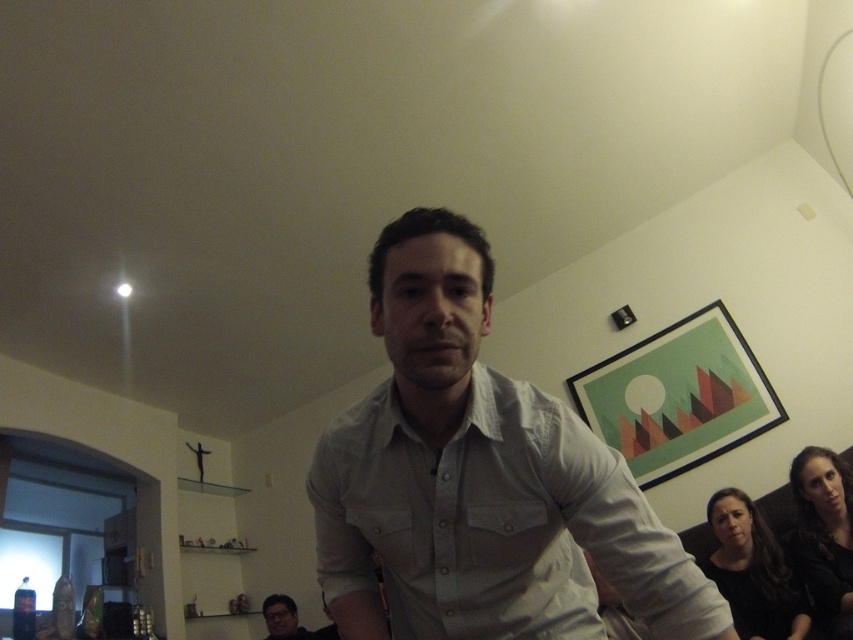
You are standing in the living room and need to locate the white cotton shirt at center and the matte gray shirt at center. Which one is positioned to the right of the other?

The white cotton shirt at center is to the right of the matte gray shirt at center.

You are standing in the living room and want to place a small plant between the two points, point (512, 397) and point (300, 637). Which point should the plant be closer to if you want it to be nearer to the foreground man?

The plant should be placed closer to point (512, 397) because it is closer to the viewer, aligning it near the foreground man.